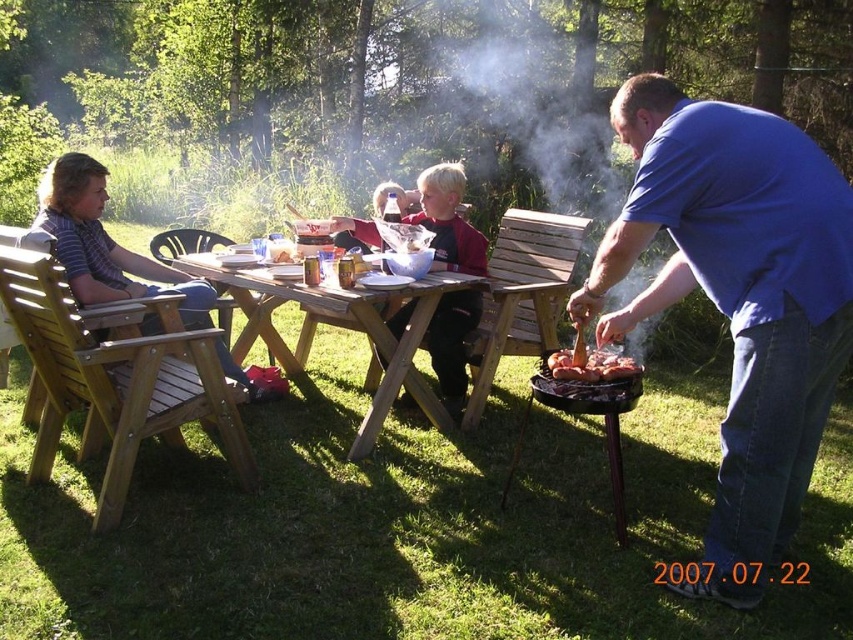
You are standing at the edge of the barbecue area and want to hand a plate to the person cooking. Which object, the dark blue shirt at center or the grilled meat at right, is closer to you?

The dark blue shirt at center is closer to you because it is further to the viewer than the grilled meat at right, meaning it is positioned nearer in the scene.